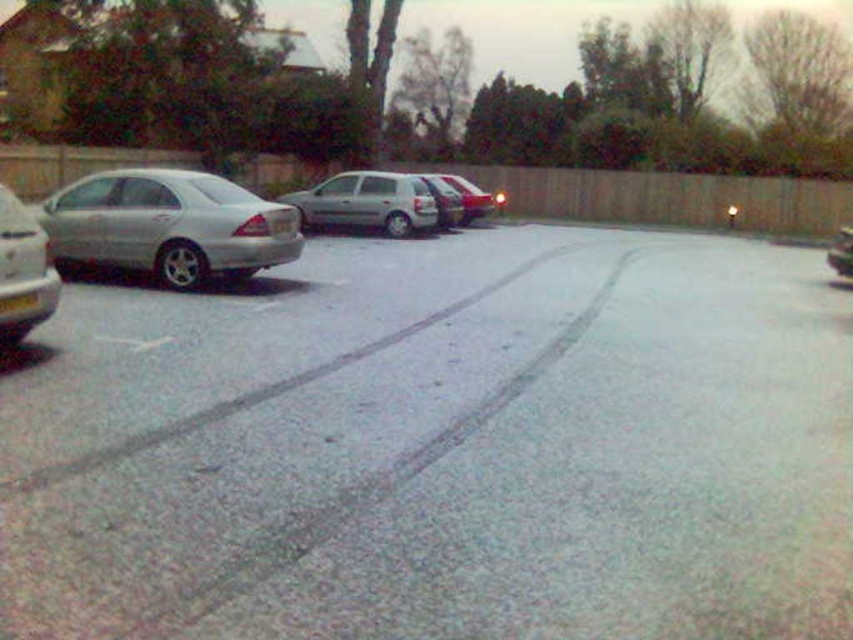
Can you confirm if satin silver sedan at left is positioned below silver metallic sedan at left?

No.

Can you confirm if satin silver sedan at left is thinner than silver metallic sedan at left?

Incorrect, satin silver sedan at left's width is not less than silver metallic sedan at left's.

The image size is (853, 640). I want to click on satin silver sedan at left, so click(x=170, y=225).

This screenshot has width=853, height=640. I want to click on satin silver sedan at left, so click(170, 225).

Image resolution: width=853 pixels, height=640 pixels. Describe the element at coordinates (22, 269) in the screenshot. I see `silver metallic sedan at left` at that location.

Who is more forward, [7,282] or [448,196]?

Positioned in front is point [7,282].

Where is `silver metallic sedan at left`? silver metallic sedan at left is located at coordinates coord(22,269).

Is silver metallic sedan at left wider than satin silver sedan at center?

Yes.

Is silver metallic sedan at left taller than satin silver sedan at center?

Correct, silver metallic sedan at left is much taller as satin silver sedan at center.

Which is in front, point (6, 296) or point (463, 202)?

Positioned in front is point (6, 296).

The height and width of the screenshot is (640, 853). I want to click on silver metallic sedan at left, so click(22, 269).